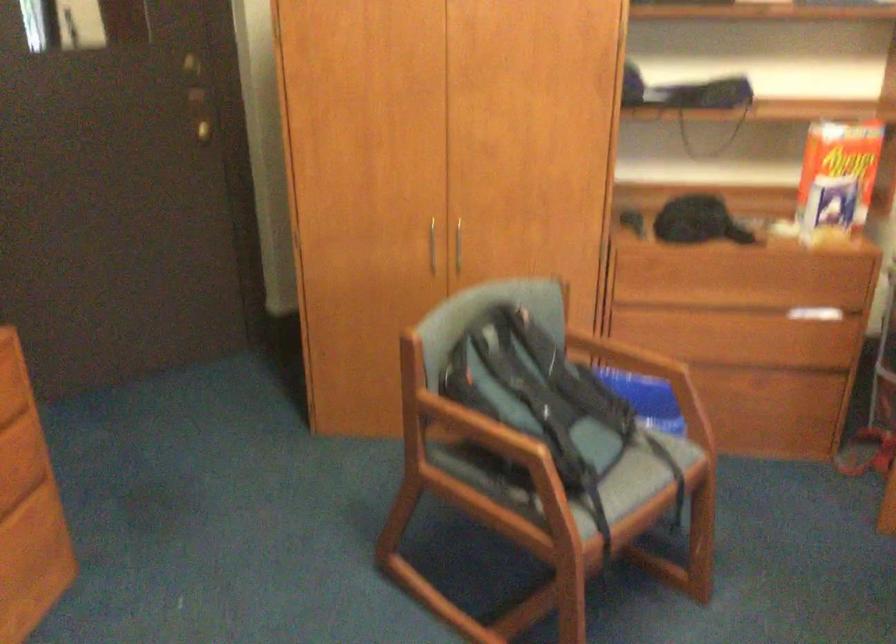
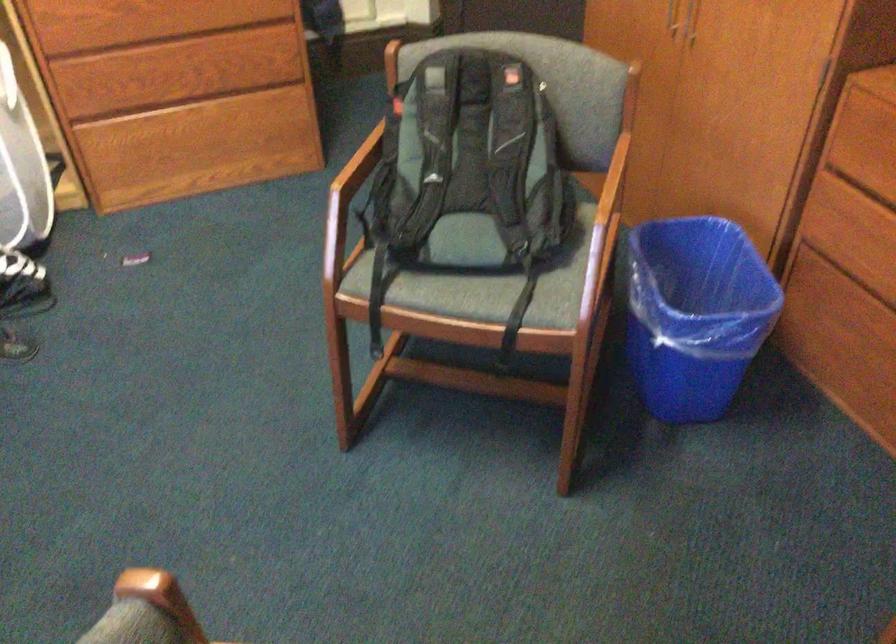
Find the pixel in the second image that matches point (645, 285) in the first image.

(864, 161)